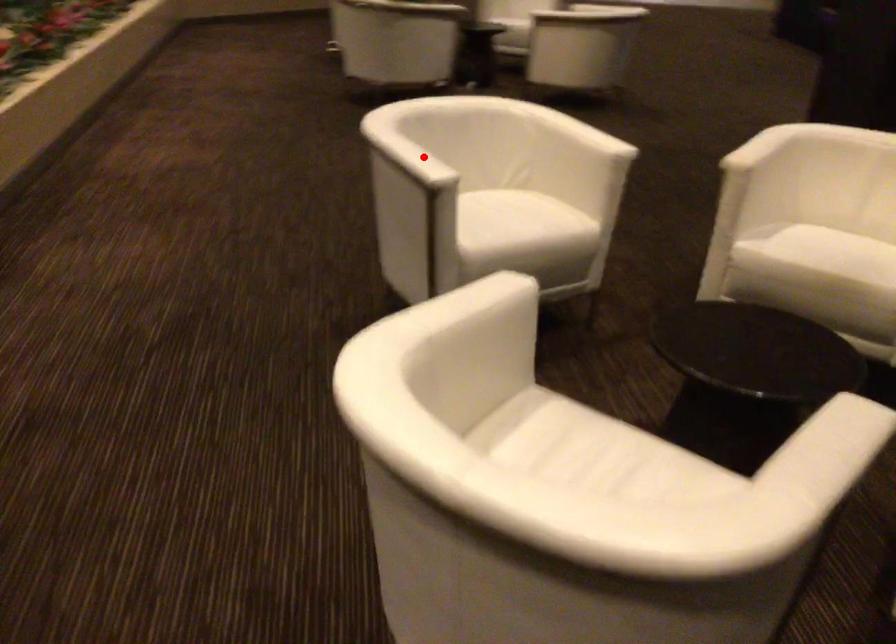
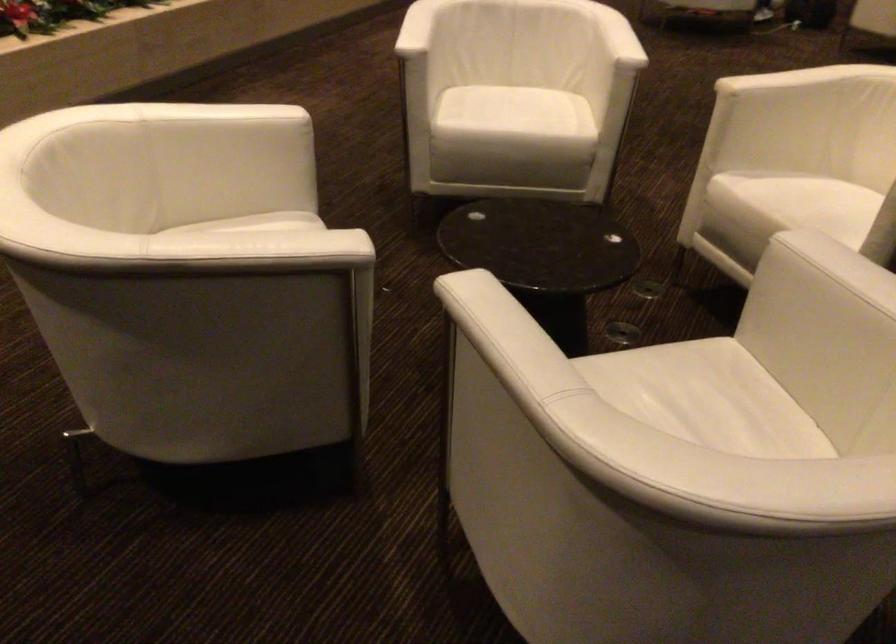
Locate, in the second image, the point that corresponds to the highlighted location in the first image.

(417, 28)